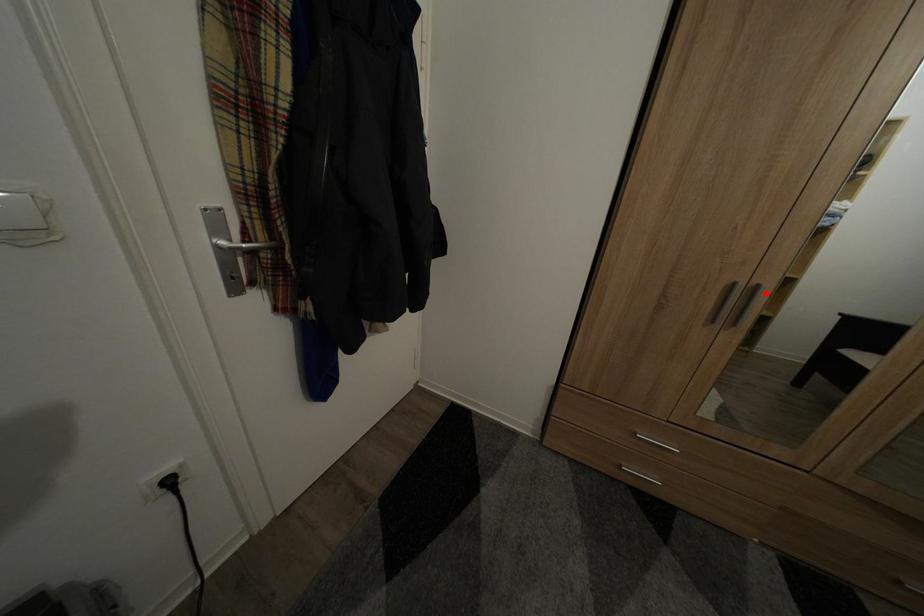
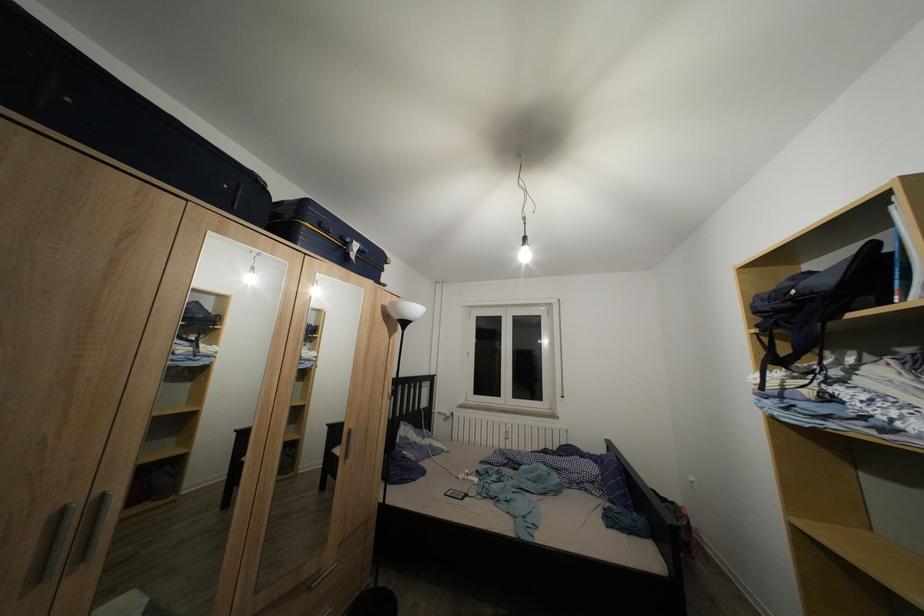
Find the pixel in the second image that matches the highlighted location in the first image.

(111, 503)